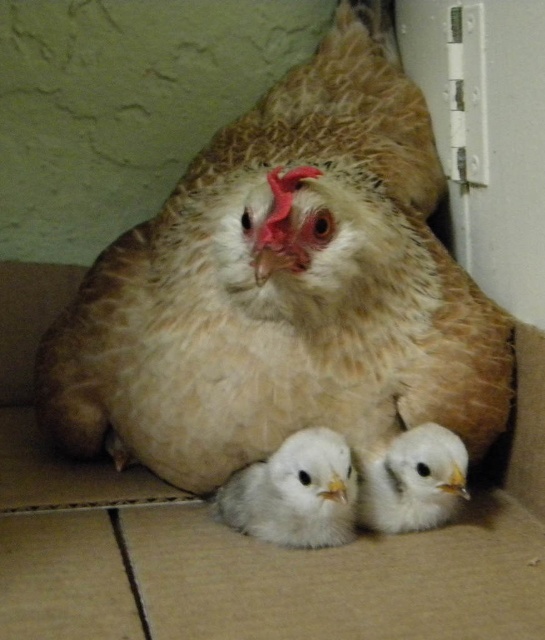
Does brown textured chicken at center appear on the right side of brown cardboard box at center?

Yes, brown textured chicken at center is to the right of brown cardboard box at center.

I want to click on brown textured chicken at center, so click(283, 289).

I want to click on brown textured chicken at center, so click(x=283, y=289).

Looking at this image, does brown textured chicken at center come in front of white fluffy chick at center?

Yes, brown textured chicken at center is in front of white fluffy chick at center.

Can you confirm if brown textured chicken at center is smaller than white fluffy chick at center?

No.

What do you see at coordinates (283, 289) in the screenshot?
I see `brown textured chicken at center` at bounding box center [283, 289].

At what (x,y) coordinates should I click in order to perform the action: click on brown textured chicken at center. Please return your answer as a coordinate pair (x, y). This screenshot has width=545, height=640. Looking at the image, I should click on (283, 289).

In the scene shown: Which of these two, brown cardboard box at center or white fluffy chick at lower center, stands taller?

brown cardboard box at center

In the scene shown: Is brown cardboard box at center taller than white fluffy chick at lower center?

Yes.

Does point (505, 524) lie in front of point (402, 488)?

That is False.

In order to click on brown cardboard box at center in this screenshot , I will do `click(243, 538)`.